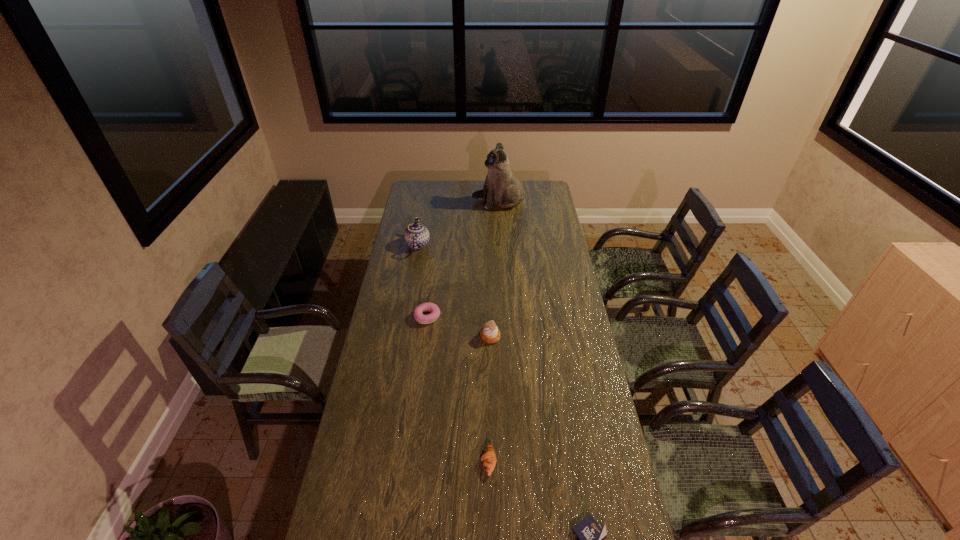
Locate an element on the screen. The height and width of the screenshot is (540, 960). object that is the third closest to the farthest pastry is located at coordinates (489, 460).

Point out which object is positioned as the third nearest to the shortest object. Please provide its 2D coordinates. Your answer should be formatted as a tuple, i.e. [(x, y)], where the tuple contains the x and y coordinates of a point satisfying the conditions above.

[(418, 312)]

This screenshot has height=540, width=960. I want to click on the second closest pastry to the second nearest object, so click(x=418, y=312).

You are a GUI agent. You are given a task and a screenshot of the screen. Output one action in this format:
    pyautogui.click(x=<x>, y=<y>)
    Task: Click on the pastry that is the third closest to the tallest object
    The width and height of the screenshot is (960, 540).
    Given the screenshot: What is the action you would take?
    pyautogui.click(x=489, y=460)

Locate an element on the screen. The image size is (960, 540). vacant point that satisfies the following two spatial constraints: 1. at the spout of the second tallest object; 2. on the right side of the tallest pastry is located at coordinates (401, 336).